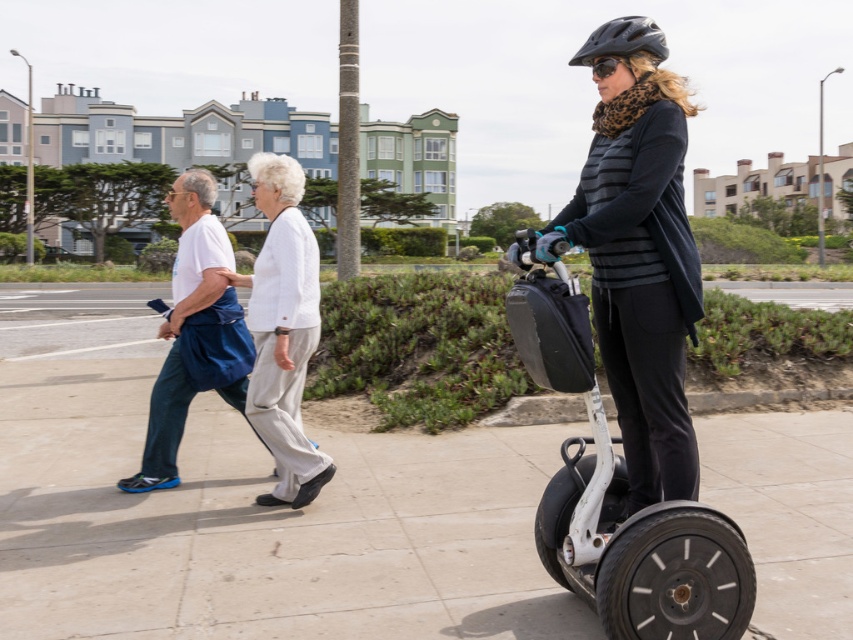
Is matte black segway at center thinner than white matte segway at center?

Indeed, matte black segway at center has a lesser width compared to white matte segway at center.

Which is in front, point (645, 321) or point (741, 576)?

Point (741, 576) is more forward.

What are the coordinates of `matte black segway at center` in the screenshot? It's located at (637, 252).

Can you confirm if matte black segway at center is thinner than white cotton pants at center?

Indeed, matte black segway at center has a lesser width compared to white cotton pants at center.

Which of these two, matte black segway at center or white cotton pants at center, stands shorter?

Standing shorter between the two is matte black segway at center.

Does point (613, 106) lie behind point (263, 403)?

No, it is not.

Image resolution: width=853 pixels, height=640 pixels. Identify the location of matte black segway at center. (x=637, y=252).

Which of these two, white matte segway at center or white cotton shirt at left, stands taller?

With more height is white matte segway at center.

Who is shorter, white matte segway at center or white cotton shirt at left?

Standing shorter between the two is white cotton shirt at left.

Between point (624, 625) and point (131, 481), which one is positioned behind?

The point (131, 481) is behind.

Image resolution: width=853 pixels, height=640 pixels. Identify the location of white matte segway at center. (619, 497).